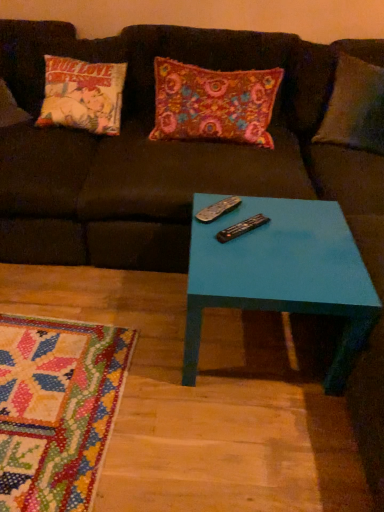
The width and height of the screenshot is (384, 512). What are the coordinates of `empty space that is to the right of black plastic remote at center, arranged as the 1th remote when viewed from the back` in the screenshot? It's located at (271, 221).